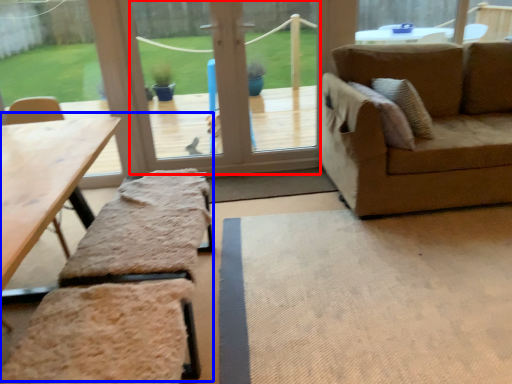
Question: Which point is closer to the camera, window screen (highlighted by a red box) or picnic table (highlighted by a blue box)?

Choices:
 (A) window screen
 (B) picnic table

Answer: (B)